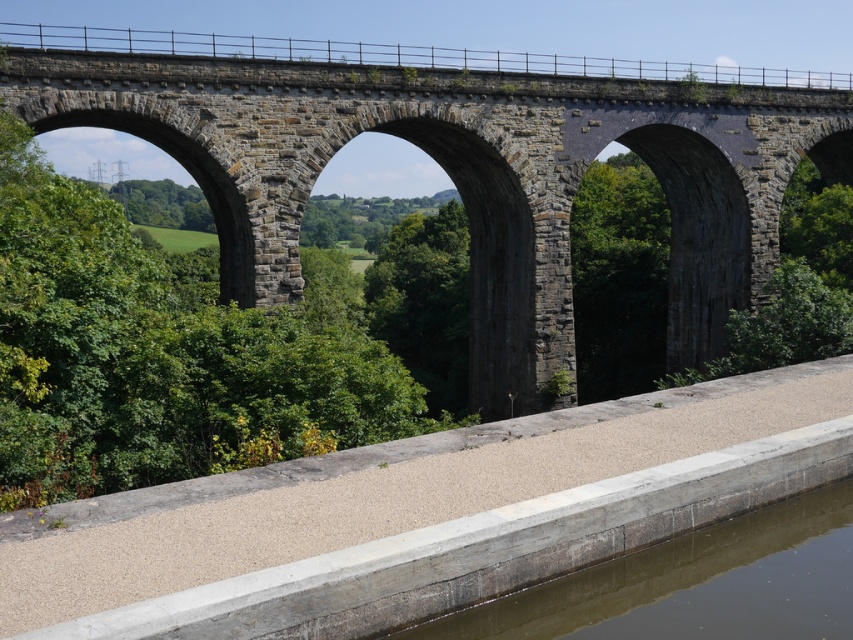
Can you confirm if dark gray stone bridge at center is positioned to the right of brown concrete river at lower center?

Indeed, dark gray stone bridge at center is positioned on the right side of brown concrete river at lower center.

Can you confirm if dark gray stone bridge at center is positioned to the left of brown concrete river at lower center?

Incorrect, dark gray stone bridge at center is not on the left side of brown concrete river at lower center.

Is point (755, 208) more distant than point (587, 604)?

Yes, it is behind point (587, 604).

Locate an element on the screen. The image size is (853, 640). dark gray stone bridge at center is located at coordinates (457, 168).